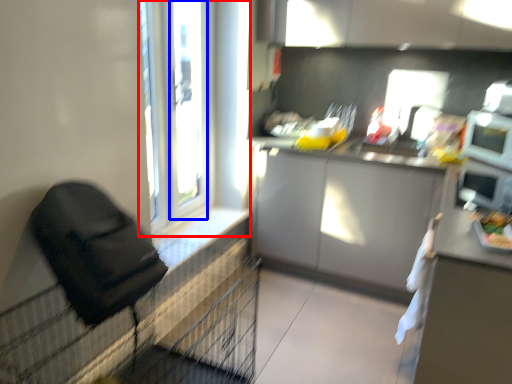
Question: Which object appears closest to the camera in this image, window (highlighted by a red box) or window frame (highlighted by a blue box)?

Choices:
 (A) window
 (B) window frame

Answer: (A)